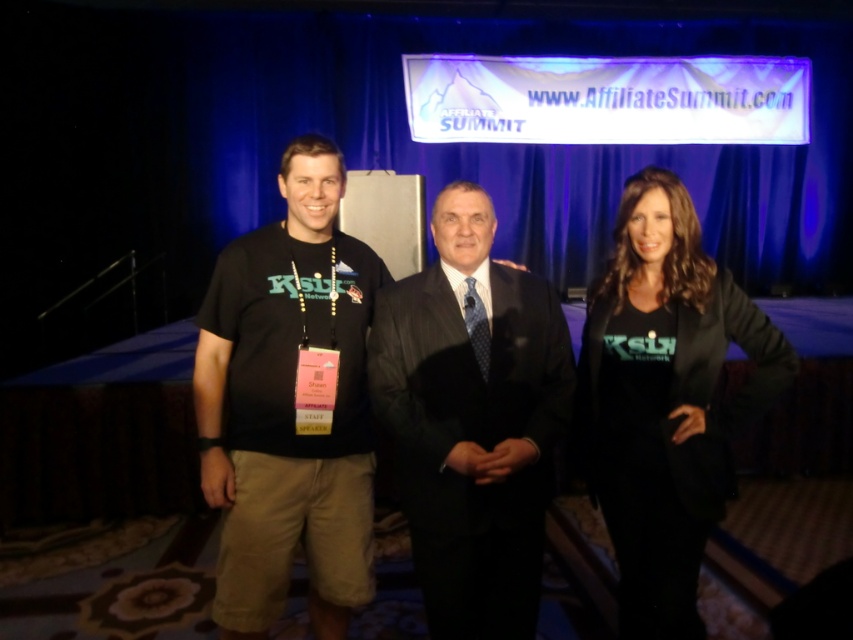
Who is more distant from viewer, (418, 452) or (624, 573)?

Point (624, 573)

Does dark suit at center have a greater width compared to black matte jacket at center?

Yes, dark suit at center is wider than black matte jacket at center.

This screenshot has height=640, width=853. In order to click on dark suit at center in this screenshot , I will do `click(473, 419)`.

Between black cotton t-shirt at left and black matte jacket at center, which one is positioned higher?

Positioned higher is black cotton t-shirt at left.

Does black cotton t-shirt at left have a lesser height compared to black matte jacket at center?

No, black cotton t-shirt at left is not shorter than black matte jacket at center.

Is point (250, 372) farther from viewer compared to point (698, 433)?

Yes.

Identify the location of black cotton t-shirt at left. (289, 404).

Who is shorter, black cotton t-shirt at left or dark suit at center?

dark suit at center is shorter.

Does point (300, 483) come farther from viewer compared to point (438, 220)?

Yes, point (300, 483) is farther from viewer.

Is point (276, 570) farther from viewer compared to point (471, 371)?

Yes, it is.

Where is `black cotton t-shirt at left`? Image resolution: width=853 pixels, height=640 pixels. black cotton t-shirt at left is located at coordinates (289, 404).